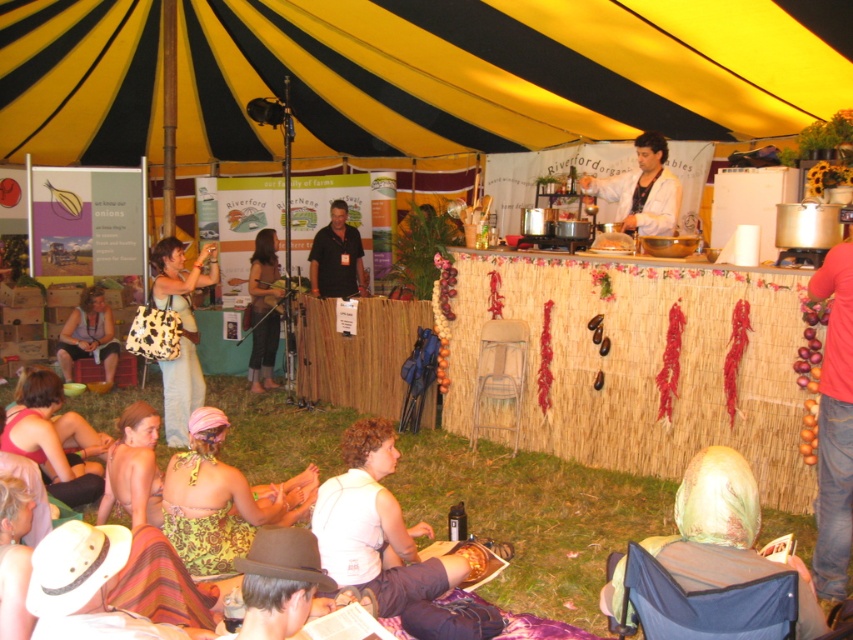
Question: Can you confirm if green fabric headscarf at lower right is positioned to the right of green floral dress at lower center?

Choices:
 (A) no
 (B) yes

Answer: (B)

Question: Considering the real-world distances, which object is closest to the red cotton shirt at right?

Choices:
 (A) green fabric headscarf at lower right
 (B) green floral dress at lower left
 (C) dark brown shirt at center
 (D) green floral dress at lower center

Answer: (A)

Question: Can you confirm if matte pink bikini at lower left is wider than dark brown shirt at center?

Choices:
 (A) yes
 (B) no

Answer: (B)

Question: Which point is closer to the camera taking this photo?

Choices:
 (A) (370, 35)
 (B) (175, 369)
 (C) (851, 483)
 (D) (265, 516)

Answer: (C)

Question: Is the position of yellow/black striped canopy at upper center more distant than that of dark brown shirt at center?

Choices:
 (A) no
 (B) yes

Answer: (A)

Question: Which of these objects is positioned closest to the green fabric headscarf at lower right?

Choices:
 (A) yellow/black striped canopy at upper center
 (B) dark brown shirt at center
 (C) leopard print bag at left

Answer: (C)